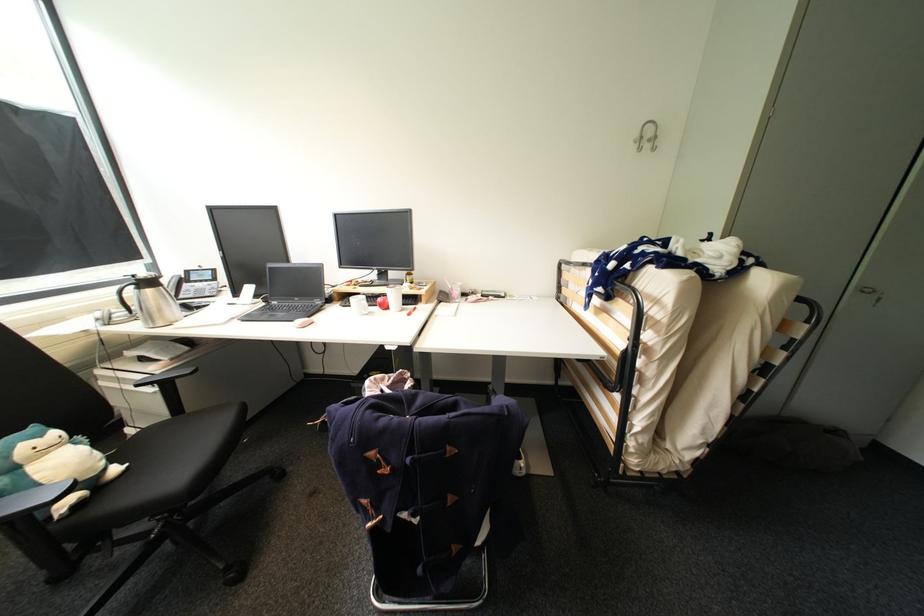
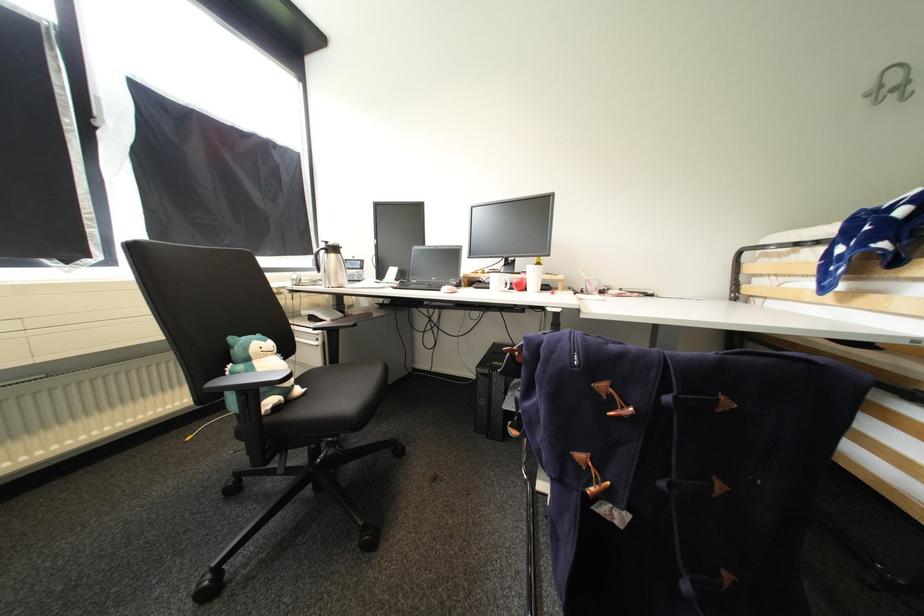
Where in the second image is the point corresponding to (371,503) from the first image?

(588, 458)